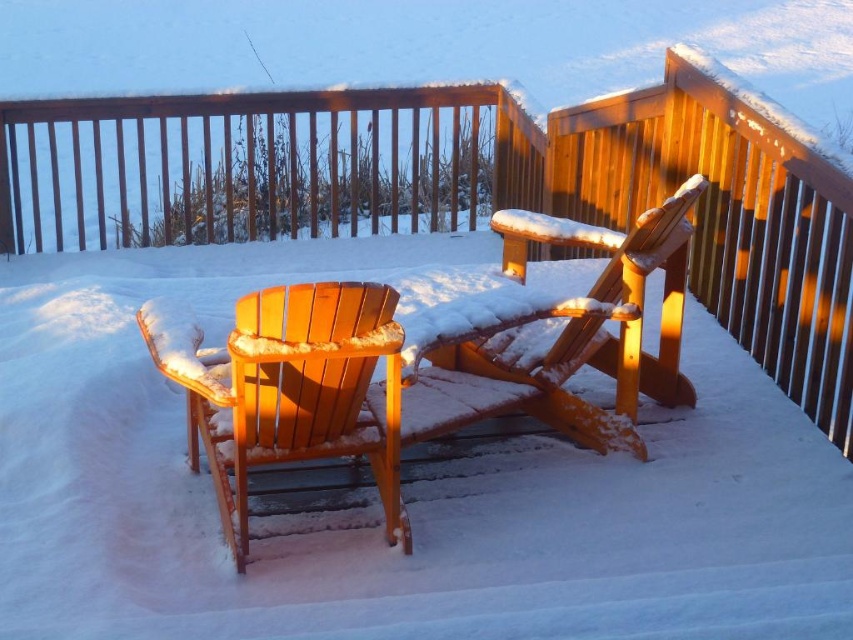
You are sitting on the deck and want to move to the other chair without stepping on the snow. Can you slide from the matte wood chair at left to the matte wood chair at center? Explain why or why not based on their positions.

The matte wood chair at left is positioned under the matte wood chair at center, so sliding from the matte wood chair at left to the matte wood chair at center is possible as they are aligned vertically.

You are standing on the deck and want to move from point [236,125] to point [682,252]. Which direction should you move to get closer to the edge of the deck?

To move from point [236,125] to point [682,252], you should move downward and to the right since point [682,252] is located lower and further to the right on the deck compared to point [236,125].

In the scene shown: You are standing on the deck and want to place a small potted plant exactly at the point marked by coordinates point (260,164). Based on the scene description, what object will the potted plant be placed near?

The point (260,164) marks the wooden railing at upper center, so the potted plant will be placed near the wooden railing at upper center.